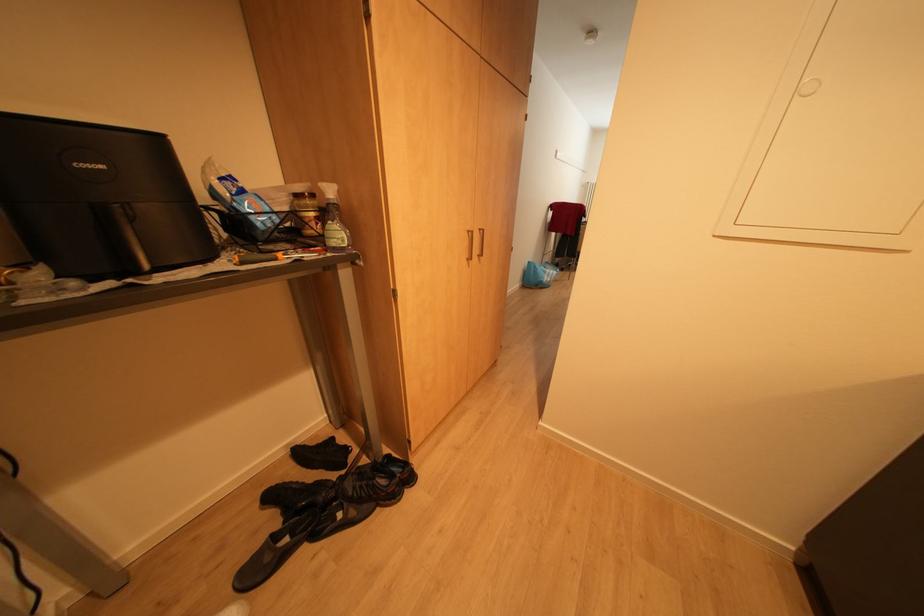
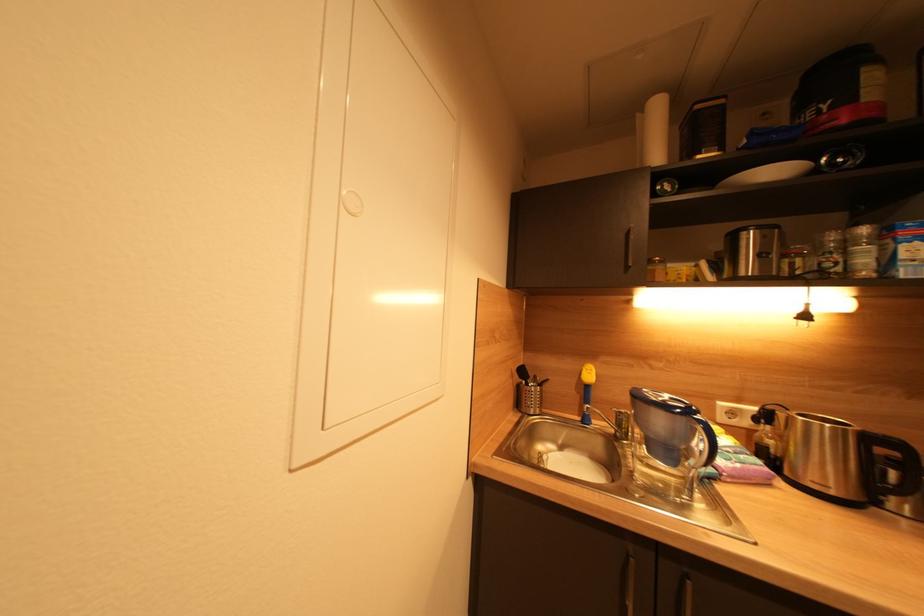
Question: The camera is either moving clockwise (left) or counter-clockwise (right) around the object. The first image is from the beginning of the video and the second image is from the end. Is the camera moving left or right when shooting the video?

Choices:
 (A) Left
 (B) Right

Answer: (A)